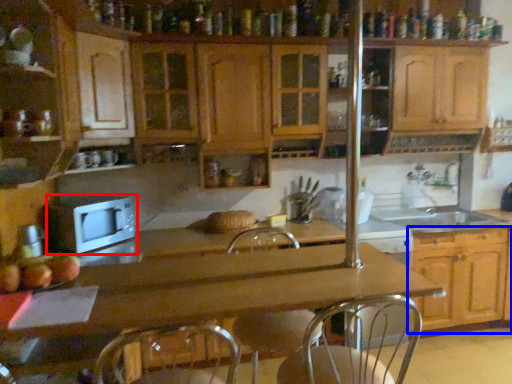
Question: Which point is further to the camera, microwave oven (highlighted by a red box) or cabinetry (highlighted by a blue box)?

Choices:
 (A) microwave oven
 (B) cabinetry

Answer: (B)